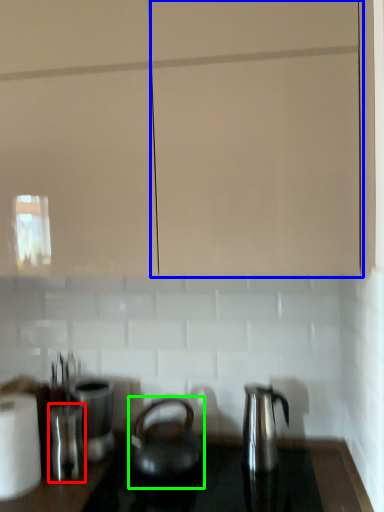
Question: Considering the real-world distances, which object is farthest from appliance (highlighted by a red box)? glass door (highlighted by a blue box) or kettle (highlighted by a green box)?

Choices:
 (A) glass door
 (B) kettle

Answer: (A)